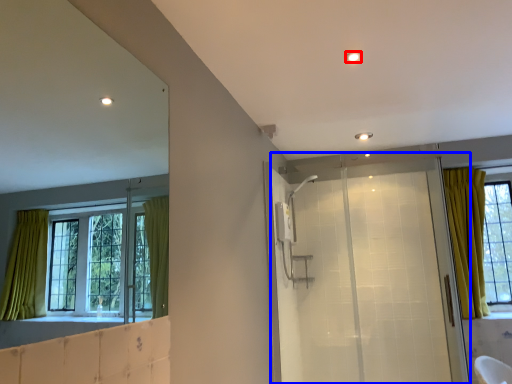
Question: Which point is closer to the camera, light (highlighted by a red box) or screen door (highlighted by a blue box)?

Choices:
 (A) light
 (B) screen door

Answer: (A)